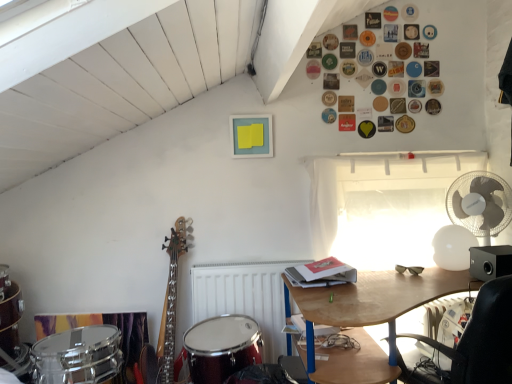
Question: From the image's perspective, is white plastic fan at right above matte black sunglasses at center right?

Choices:
 (A) yes
 (B) no

Answer: (A)

Question: From the image's perspective, does white plastic fan at right appear lower than matte black sunglasses at center right?

Choices:
 (A) no
 (B) yes

Answer: (A)

Question: Does white plastic fan at right turn towards matte black sunglasses at center right?

Choices:
 (A) yes
 (B) no

Answer: (A)

Question: Is white plastic fan at right to the right of matte black sunglasses at center right from the viewer's perspective?

Choices:
 (A) yes
 (B) no

Answer: (A)

Question: Is white plastic fan at right positioned in front of matte black sunglasses at center right?

Choices:
 (A) yes
 (B) no

Answer: (A)

Question: Is white plastic fan at right shorter than matte black sunglasses at center right?

Choices:
 (A) yes
 (B) no

Answer: (B)

Question: Does shiny red drum at lower left appear on the left side of white matte radiator at lower center?

Choices:
 (A) yes
 (B) no

Answer: (A)

Question: Does shiny red drum at lower left have a greater height compared to white matte radiator at lower center?

Choices:
 (A) yes
 (B) no

Answer: (B)

Question: From a real-world perspective, is shiny red drum at lower left physically above white matte radiator at lower center?

Choices:
 (A) no
 (B) yes

Answer: (A)

Question: Does shiny red drum at lower left turn towards white matte radiator at lower center?

Choices:
 (A) no
 (B) yes

Answer: (A)

Question: Does shiny red drum at lower left have a lesser height compared to white matte radiator at lower center?

Choices:
 (A) no
 (B) yes

Answer: (B)

Question: Is the depth of shiny red drum at lower left less than that of white matte radiator at lower center?

Choices:
 (A) no
 (B) yes

Answer: (B)

Question: Is shiny red drum at lower left a part of white sheer curtain at upper right?

Choices:
 (A) yes
 (B) no

Answer: (B)